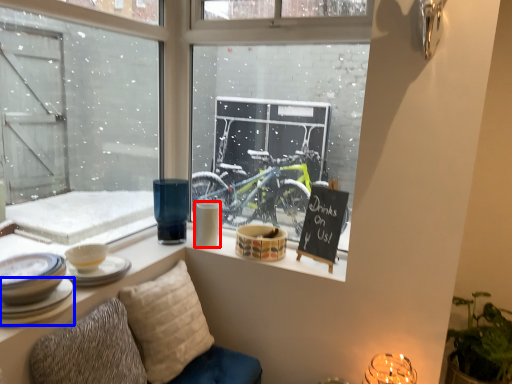
Question: Which of the following is the closest to the observer, tableware (highlighted by a red box) or tableware (highlighted by a blue box)?

Choices:
 (A) tableware
 (B) tableware

Answer: (B)